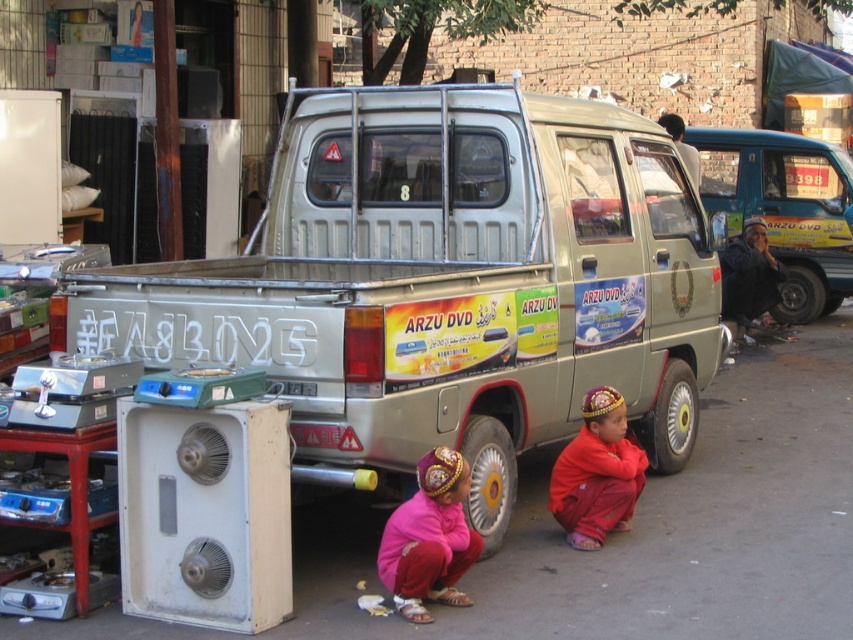
Does silver metallic pickup truck at center appear over metallic silver van at right?

Incorrect, silver metallic pickup truck at center is not positioned above metallic silver van at right.

Does silver metallic pickup truck at center have a lesser width compared to metallic silver van at right?

In fact, silver metallic pickup truck at center might be wider than metallic silver van at right.

Does point (643, 196) come behind point (844, 166)?

That is False.

Locate an element on the screen. silver metallic pickup truck at center is located at coordinates (436, 273).

Between silver metallic pickup truck at center and red cotton pants at lower center, which one is positioned higher?

silver metallic pickup truck at center is above.

The image size is (853, 640). Describe the element at coordinates (436, 273) in the screenshot. I see `silver metallic pickup truck at center` at that location.

The width and height of the screenshot is (853, 640). Describe the element at coordinates (436, 273) in the screenshot. I see `silver metallic pickup truck at center` at that location.

Image resolution: width=853 pixels, height=640 pixels. What are the coordinates of `silver metallic pickup truck at center` in the screenshot? It's located at (436, 273).

Looking at this image, who is shorter, pink fabric pants at lower center or yellow rubber tire at lower right?

Standing shorter between the two is yellow rubber tire at lower right.

Can you confirm if pink fabric pants at lower center is smaller than yellow rubber tire at lower right?

Correct, pink fabric pants at lower center occupies less space than yellow rubber tire at lower right.

Does point (395, 513) come in front of point (688, 426)?

Yes, point (395, 513) is closer to viewer.

Identify the location of pink fabric pants at lower center. (428, 538).